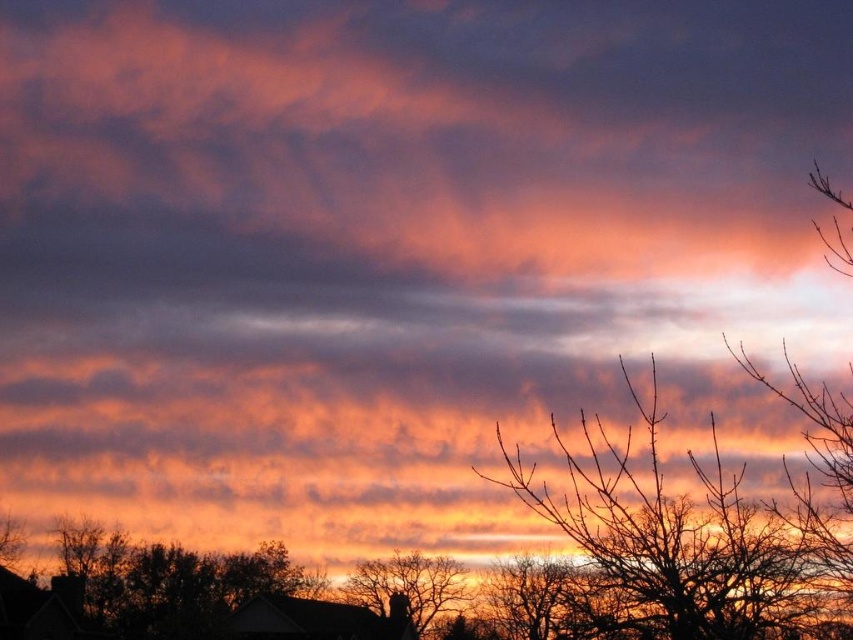
You are an artist sketching the sunset scene. You notice the smooth bark tree at center and the silhouette bare tree at lower center. Which tree should you draw wider in your sketch to accurately represent their actual sizes?

You should draw the smooth bark tree at center wider than the silhouette bare tree at lower center because its width surpasses the latter according to the description.

You are an artist trying to paint the sunset scene. You notice two trees in the foreground. Which tree, the smooth bark tree at center or the silhouette bare tree at lower center, should you paint first if you want to follow the rule of painting taller objects before shorter ones?

The smooth bark tree at center is taller than the silhouette bare tree at lower center, so you should paint the smooth bark tree at center first.

Consider the image. You are an artist trying to paint the sunset scene. You want to ensure the smooth bark tree at center and the silhouette bare tree at lower center are proportionally accurate. Which tree should you draw larger in your painting?

The smooth bark tree at center should be drawn larger than the silhouette bare tree at lower center because it is bigger in the scene.